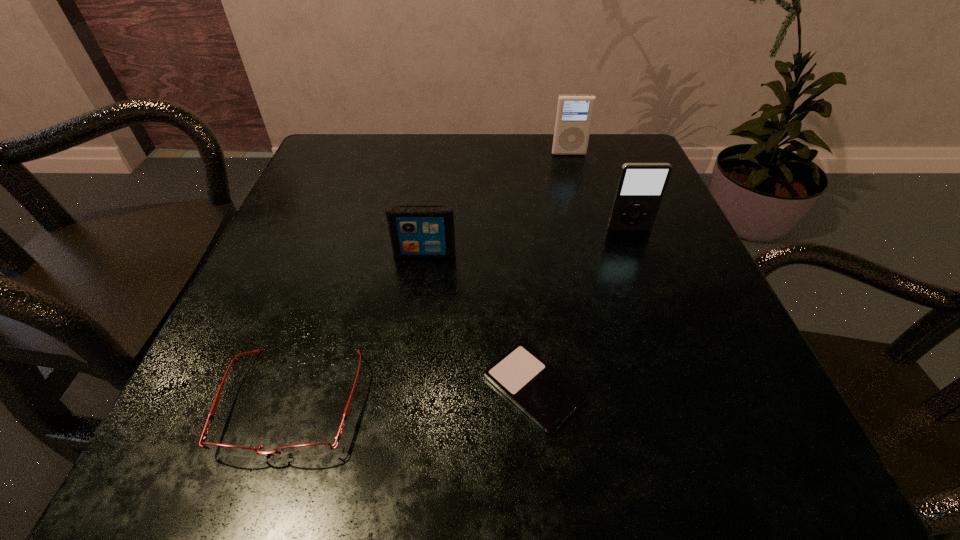
Where is `the second farthest iPod`? the second farthest iPod is located at coordinates (641, 186).

Locate an element on the screen. This screenshot has width=960, height=540. the farthest object is located at coordinates (574, 113).

Find the location of `the third farthest iPod`. the third farthest iPod is located at coordinates (416, 231).

In order to click on the leftmost iPod in this screenshot , I will do (x=416, y=231).

This screenshot has height=540, width=960. What are the coordinates of `the fourth tallest object` in the screenshot? It's located at (311, 449).

Identify the location of spectacles. (311, 449).

Where is `the shortest object`? The image size is (960, 540). the shortest object is located at coordinates (544, 395).

This screenshot has height=540, width=960. I want to click on the nearest iPod, so click(x=544, y=395).

Identify the location of free spot located on the front-facing side of the second farthest object. (696, 405).

The image size is (960, 540). I want to click on vacant space located 0.090m on the front-facing side of the farthest object, so click(x=575, y=178).